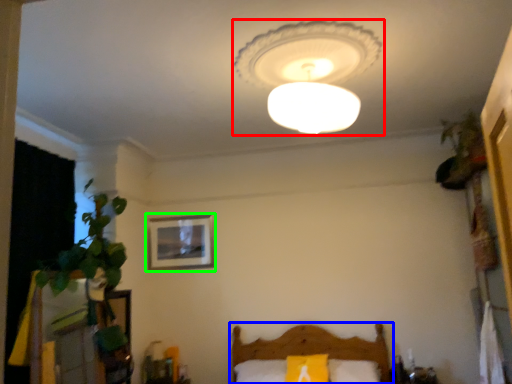
Question: Considering the real-world distances, which object is farthest from lamp (highlighted by a red box)? furniture (highlighted by a blue box) or picture frame (highlighted by a green box)?

Choices:
 (A) furniture
 (B) picture frame

Answer: (A)